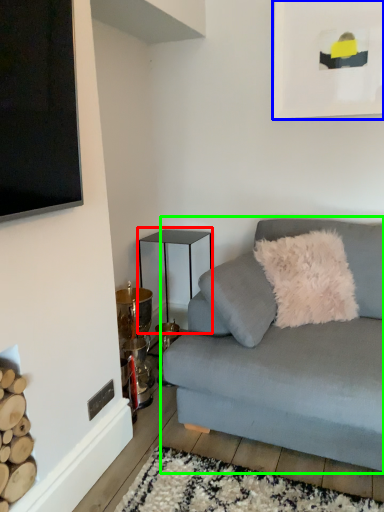
Question: Which object is positioned closest to table (highlighted by a red box)? Select from picture frame (highlighted by a blue box) and studio couch (highlighted by a green box).

Choices:
 (A) picture frame
 (B) studio couch

Answer: (B)